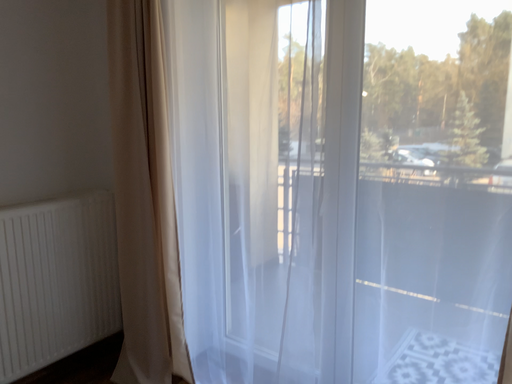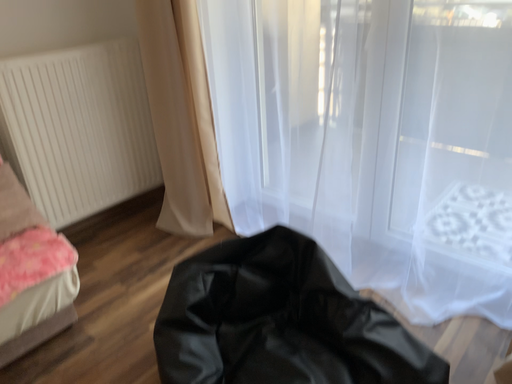
Question: How did the camera likely rotate when shooting the video?

Choices:
 (A) rotated downward
 (B) rotated upward

Answer: (A)